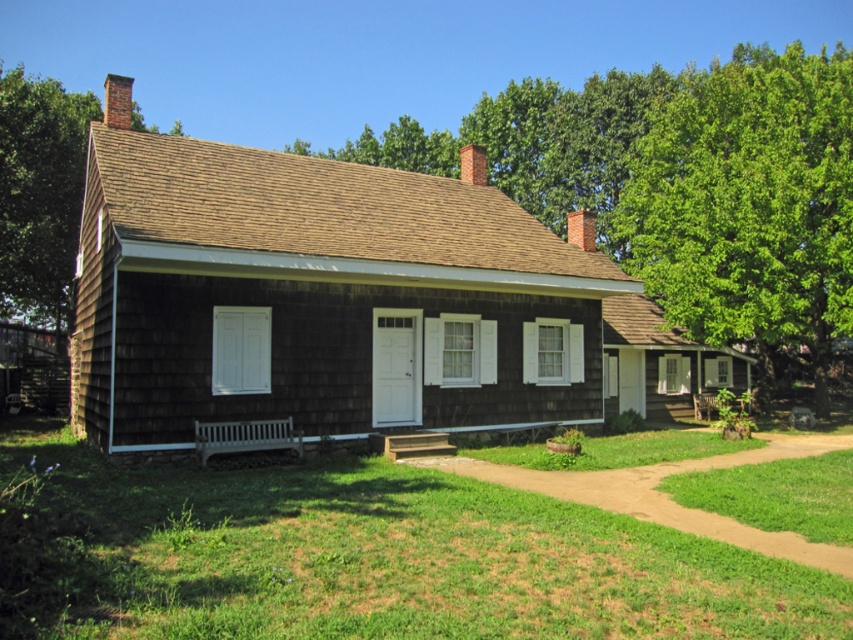
You are a gardener who wants to plant flowers on the green grass at lower center and the brown shingles at upper left. Which location has enough space to accommodate larger flower pots?

The brown shingles at upper left has a larger size compared to the green grass at lower center, so it can accommodate larger flower pots.

You are standing in front of the house and want to sit down. Which object, the green grass at lower center or the green leafy tree at upper right, is closer to you?

The green grass at lower center is closer to the viewer than the green leafy tree at upper right, so you can sit on the green grass at lower center.

You are standing in front of the house and notice a point at coordinates (749, 202). What does this point represent?

The point at (749, 202) represents the green leafy tree at upper right.